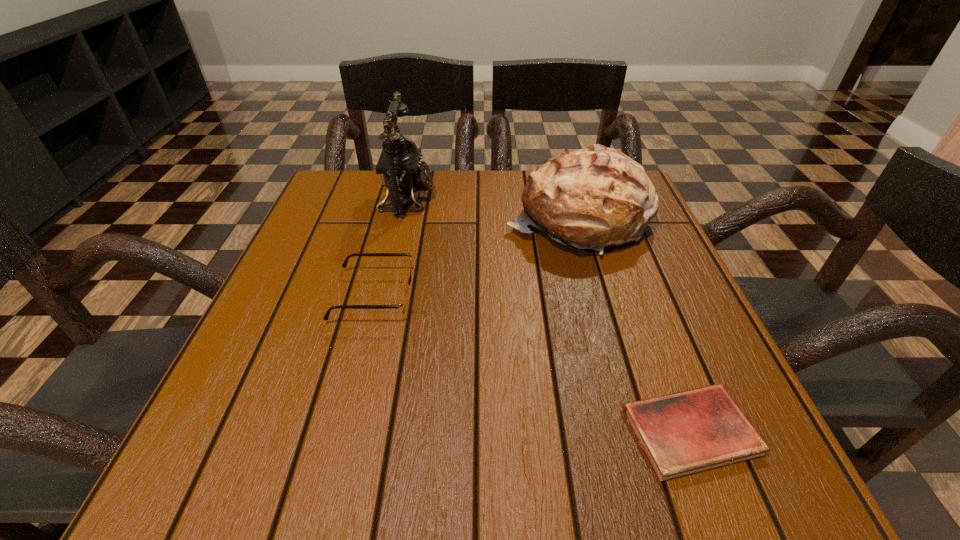
Where is `blank space at the far edge of the desktop`? blank space at the far edge of the desktop is located at coordinates (394, 217).

What are the coordinates of `blank area at the near edge` in the screenshot? It's located at (537, 437).

The height and width of the screenshot is (540, 960). I want to click on vacant area at the left edge of the desktop, so click(x=247, y=386).

Where is `vacant space at the right edge of the desktop`? vacant space at the right edge of the desktop is located at coordinates (660, 318).

At what (x,y) coordinates should I click in order to perform the action: click on vacant space at the far left corner of the desktop. Please return your answer as a coordinate pair (x, y). This screenshot has height=540, width=960. Looking at the image, I should click on (366, 212).

Where is `free region at the near right corner of the desktop`? free region at the near right corner of the desktop is located at coordinates (719, 477).

Where is `free area in between the bread and the telephone`? Image resolution: width=960 pixels, height=540 pixels. free area in between the bread and the telephone is located at coordinates (492, 209).

At what (x,y) coordinates should I click in order to perform the action: click on free space that is in between the bread and the nearest object. Please return your answer as a coordinate pair (x, y). This screenshot has height=540, width=960. Looking at the image, I should click on (634, 325).

Image resolution: width=960 pixels, height=540 pixels. I want to click on free space between the shortest object and the tallest object, so click(549, 315).

Identify the location of free space that is in between the third shortest object and the telephone. This screenshot has height=540, width=960. (492, 209).